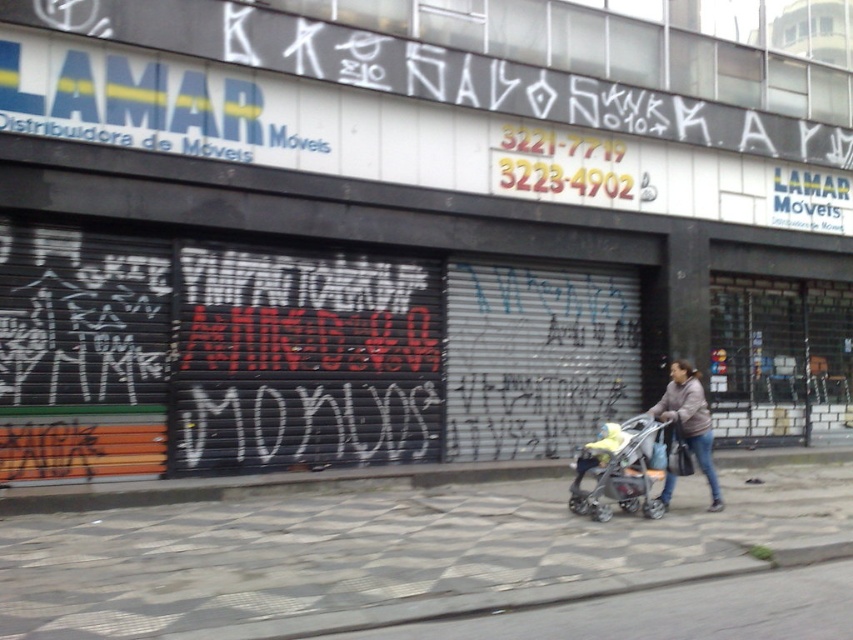
Who is higher up, checkerboard tile pavement at center or brown fuzzy jacket at lower right?

brown fuzzy jacket at lower right

The height and width of the screenshot is (640, 853). What do you see at coordinates (367, 548) in the screenshot?
I see `checkerboard tile pavement at center` at bounding box center [367, 548].

Which is behind, point (785, 515) or point (701, 387)?

The point (701, 387) is more distant.

The image size is (853, 640). What are the coordinates of `checkerboard tile pavement at center` in the screenshot? It's located at (367, 548).

Can you confirm if checkerboard tile pavement at center is thinner than yellow fabric baby carriage at center?

Indeed, checkerboard tile pavement at center has a lesser width compared to yellow fabric baby carriage at center.

Between checkerboard tile pavement at center and yellow fabric baby carriage at center, which one appears on the right side from the viewer's perspective?

Positioned to the right is yellow fabric baby carriage at center.

You are a GUI agent. You are given a task and a screenshot of the screen. Output one action in this format:
    pyautogui.click(x=<x>, y=<y>)
    Task: Click on the checkerboard tile pavement at center
    
    Given the screenshot: What is the action you would take?
    pyautogui.click(x=367, y=548)

Locate an element on the screen. The width and height of the screenshot is (853, 640). checkerboard tile pavement at center is located at coordinates (367, 548).

Who is shorter, checkerboard tile pavement at center or gray fabric stroller at center?

checkerboard tile pavement at center is shorter.

Who is more forward, (732,497) or (579,472)?

Positioned in front is point (579,472).

This screenshot has width=853, height=640. What are the coordinates of `checkerboard tile pavement at center` in the screenshot? It's located at (367, 548).